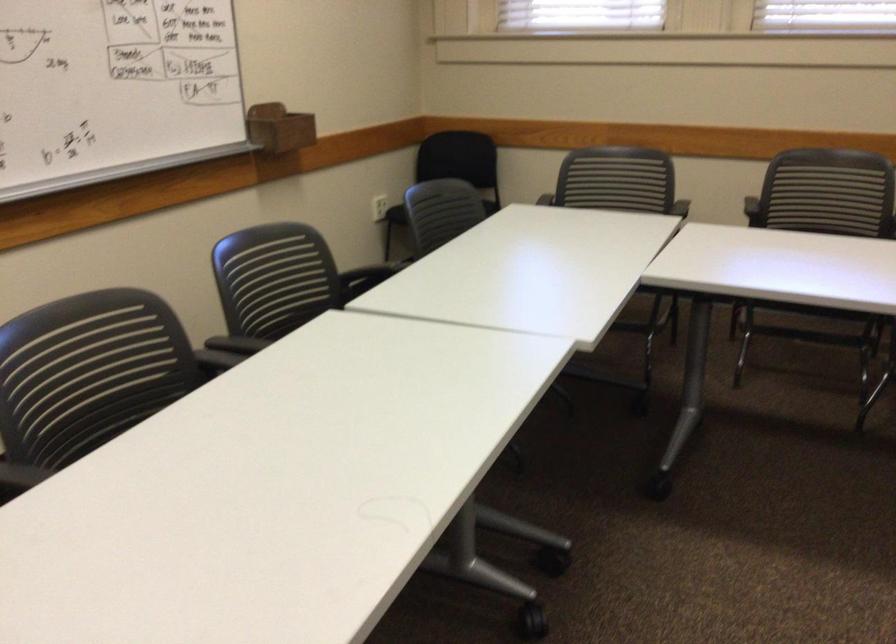
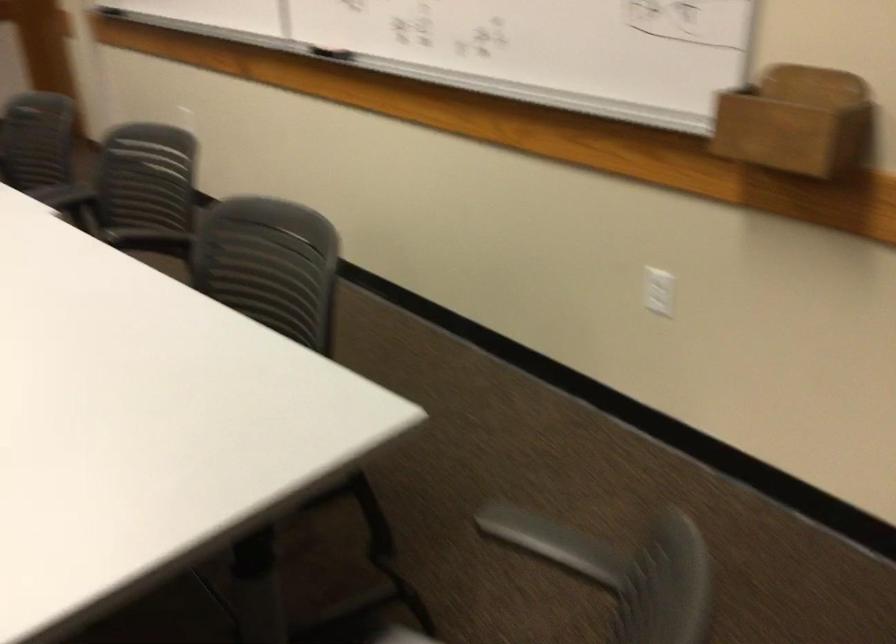
Question: I am providing you with two images of the same scene from different viewpoints. Which of the following objects are not visible in image2?

Choices:
 (A) cut lime half
 (B) chair sitting surface
 (C) grey chair armrest
 (D) wooden wall holder

Answer: (B)